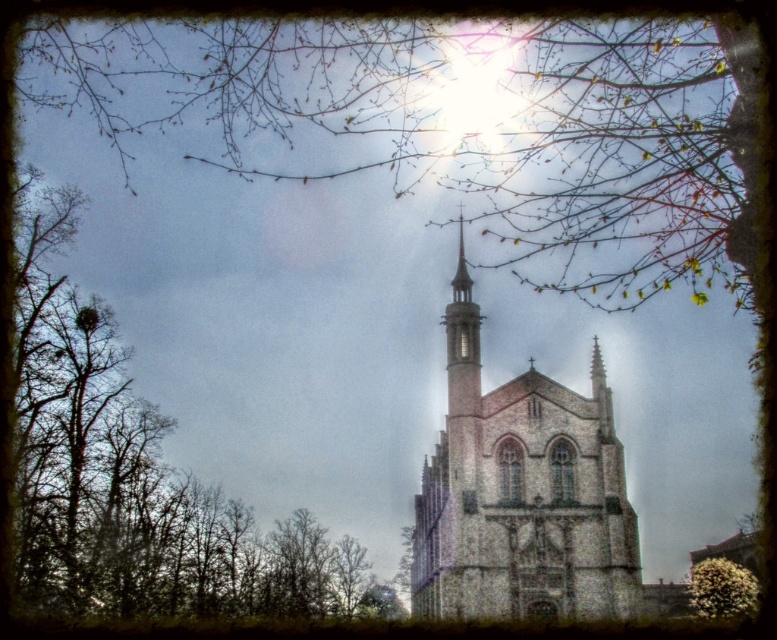
Question: Considering the real-world distances, which object is farthest from the brick stone tower at center?

Choices:
 (A) brown leafless tree at left
 (B) green fuzzy bush at lower right
 (C) smooth stone spire at center

Answer: (A)

Question: Which of the following is the farthest from the observer?

Choices:
 (A) brown leafless tree at left
 (B) green fuzzy bush at lower right
 (C) smooth stone spire at center

Answer: (A)

Question: Considering the relative positions of brown leafless tree at left and green fuzzy bush at lower right in the image provided, where is brown leafless tree at left located with respect to green fuzzy bush at lower right?

Choices:
 (A) above
 (B) below

Answer: (A)

Question: Is the position of brown leafless tree at left less distant than that of smooth stone spire at center?

Choices:
 (A) no
 (B) yes

Answer: (A)

Question: Observing the image, what is the correct spatial positioning of brown leafless tree at left in reference to smooth stone spire at center?

Choices:
 (A) below
 (B) above

Answer: (A)

Question: Based on their relative distances, which object is nearer to the brick stone tower at center?

Choices:
 (A) brown leafless tree at left
 (B) smooth stone spire at center

Answer: (B)